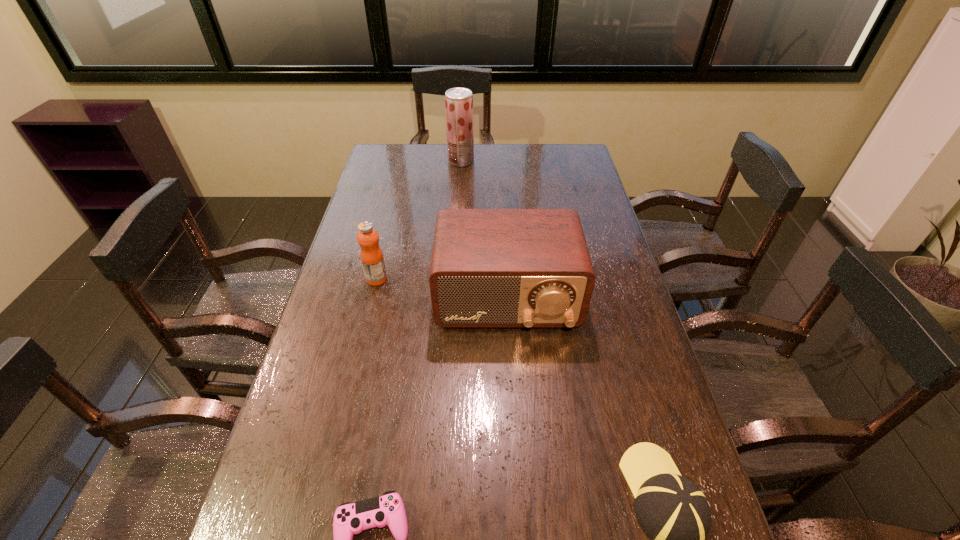
Locate an element on the screen. Image resolution: width=960 pixels, height=540 pixels. vacant area at the left edge of the desktop is located at coordinates (351, 295).

Image resolution: width=960 pixels, height=540 pixels. Identify the location of free space at the right edge of the desktop. (657, 403).

I want to click on free space between the leftmost object and the farther fruit juice, so click(x=419, y=220).

Find the location of a particular element. the third closest object relative to the radio receiver is located at coordinates (350, 518).

Select which object appears as the second closest to the rightmost object. Please provide its 2D coordinates. Your answer should be formatted as a tuple, i.e. [(x, y)], where the tuple contains the x and y coordinates of a point satisfying the conditions above.

[(350, 518)]